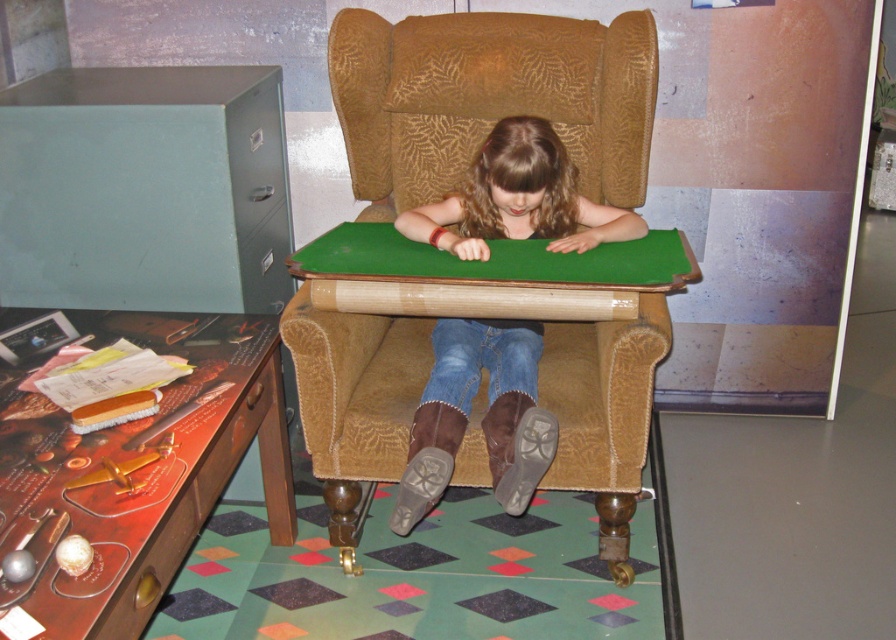
Can you confirm if brown textured armchair at center is taller than denim jeans at center?

Indeed, brown textured armchair at center has a greater height compared to denim jeans at center.

Which is in front, point (341, 531) or point (457, 449)?

Point (457, 449) is more forward.

The image size is (896, 640). Identify the location of brown textured armchair at center. (426, 378).

Which of these two, wooden desk at lower left or denim jeans at center, stands taller?

wooden desk at lower left

Can you confirm if wooden desk at lower left is wider than denim jeans at center?

No.

Who is more forward, [119,438] or [419,429]?

Point [119,438] is more forward.

Where is `wooden desk at lower left`? wooden desk at lower left is located at coordinates (139, 481).

Does brown textured armchair at center appear under wooden desk at lower left?

Actually, brown textured armchair at center is above wooden desk at lower left.

Is point (636, 365) more distant than point (278, 449)?

No, it is not.

Consider the image. Who is more forward, (340, 492) or (251, 369)?

Positioned in front is point (251, 369).

In order to click on brown textured armchair at center in this screenshot , I will do `click(426, 378)`.